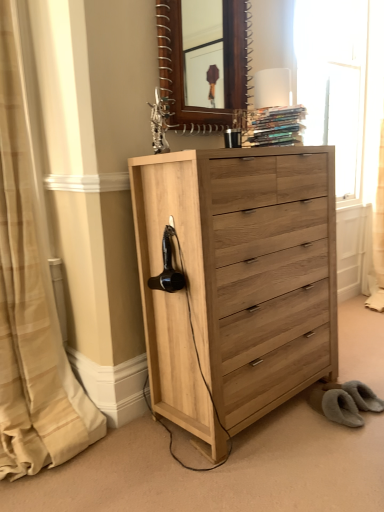
Question: Does matte white table lamp at upper center have a lesser height compared to transparent glass window at upper right?

Choices:
 (A) no
 (B) yes

Answer: (B)

Question: From the image's perspective, is matte white table lamp at upper center over transparent glass window at upper right?

Choices:
 (A) yes
 (B) no

Answer: (B)

Question: From a real-world perspective, is matte white table lamp at upper center under transparent glass window at upper right?

Choices:
 (A) yes
 (B) no

Answer: (A)

Question: Is matte white table lamp at upper center not close to transparent glass window at upper right?

Choices:
 (A) no
 (B) yes

Answer: (B)

Question: Is the surface of matte white table lamp at upper center in direct contact with transparent glass window at upper right?

Choices:
 (A) no
 (B) yes

Answer: (A)

Question: From the image's perspective, is matte white table lamp at upper center under transparent glass window at upper right?

Choices:
 (A) no
 (B) yes

Answer: (B)

Question: From the image's perspective, does beige striped curtain at left appear lower than matte white table lamp at upper center?

Choices:
 (A) no
 (B) yes

Answer: (B)

Question: Is beige striped curtain at left aimed at matte white table lamp at upper center?

Choices:
 (A) yes
 (B) no

Answer: (B)

Question: Considering the relative sizes of beige striped curtain at left and matte white table lamp at upper center in the image provided, is beige striped curtain at left wider than matte white table lamp at upper center?

Choices:
 (A) yes
 (B) no

Answer: (A)

Question: Is beige striped curtain at left to the left of matte white table lamp at upper center from the viewer's perspective?

Choices:
 (A) no
 (B) yes

Answer: (B)

Question: Is beige striped curtain at left behind matte white table lamp at upper center?

Choices:
 (A) no
 (B) yes

Answer: (A)

Question: From a real-world perspective, is beige striped curtain at left located higher than matte white table lamp at upper center?

Choices:
 (A) no
 (B) yes

Answer: (A)

Question: Can you confirm if matte white table lamp at upper center is smaller than hardcover books at upper center?

Choices:
 (A) yes
 (B) no

Answer: (A)